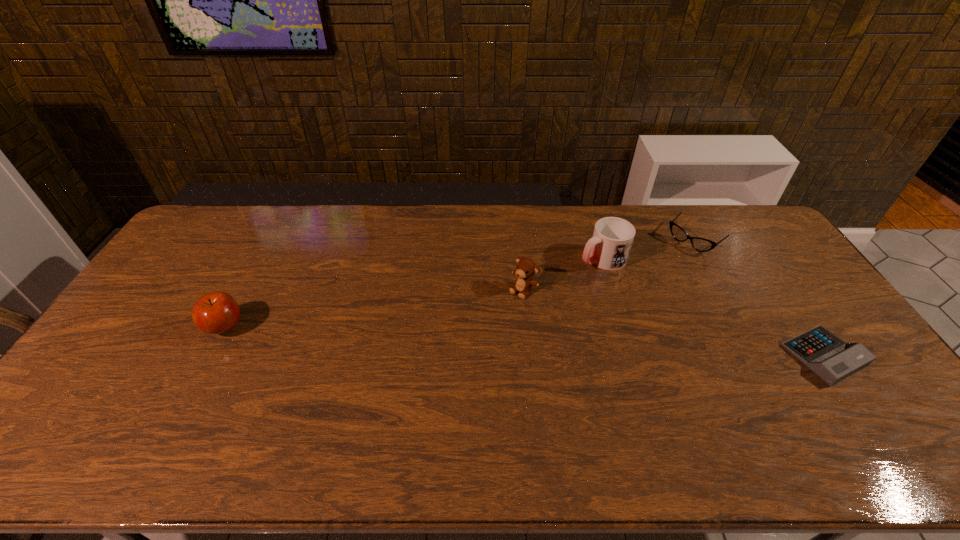
The image size is (960, 540). What are the coordinates of `blank space at the near edge of the desktop` in the screenshot? It's located at (747, 417).

I want to click on vacant region at the far left corner of the desktop, so click(225, 221).

Locate an element on the screen. Image resolution: width=960 pixels, height=540 pixels. vacant space at the far right corner of the desktop is located at coordinates coord(727,229).

I want to click on vacant area at the near right corner, so click(867, 402).

Locate an element on the screen. The width and height of the screenshot is (960, 540). vacant region between the mug and the calculator is located at coordinates (713, 307).

The width and height of the screenshot is (960, 540). I want to click on free area in between the apple and the calculator, so click(x=524, y=341).

The image size is (960, 540). I want to click on empty location between the leftmost object and the calculator, so click(x=524, y=341).

I want to click on empty space that is in between the fourth object from right to left and the shortest object, so click(674, 322).

This screenshot has width=960, height=540. I want to click on free space between the second object from left to right and the shortest object, so click(x=674, y=322).

Where is `free spot between the third object from right to left and the third farthest object`? The height and width of the screenshot is (540, 960). free spot between the third object from right to left and the third farthest object is located at coordinates (563, 274).